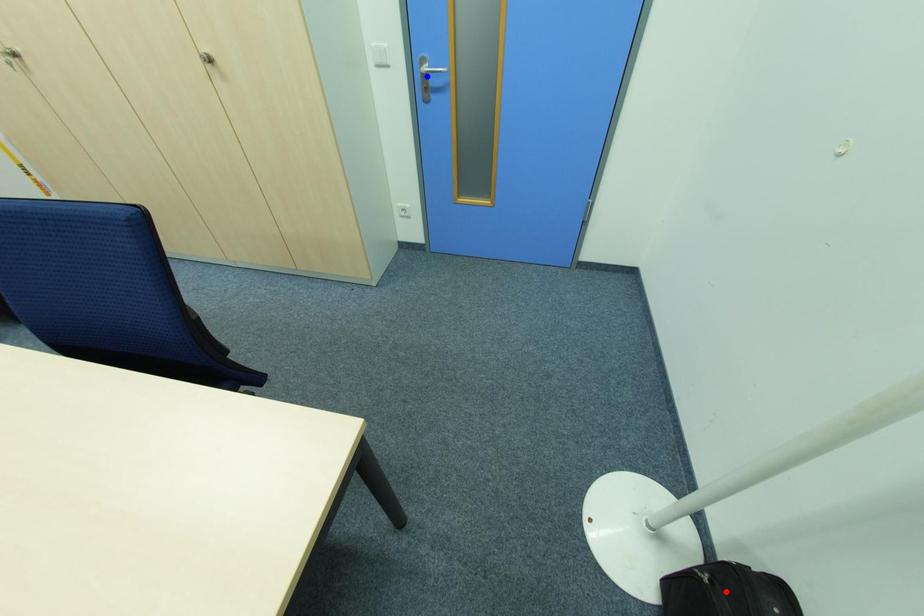
Question: Two points are marked on the image. Which point is closer to the camera?

Choices:
 (A) Blue point is closer.
 (B) Red point is closer.

Answer: (B)